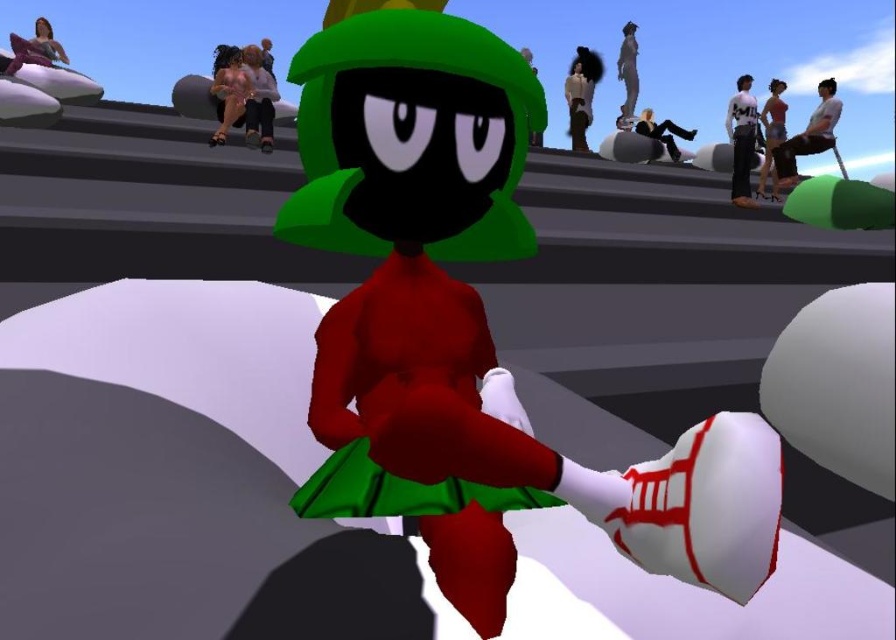
You are a GUI agent. You are given a task and a screenshot of the screen. Output one action in this format:
    pyautogui.click(x=<x>, y=<y>)
    Task: Click on the smooth white shirt at upper right
    
    Given the screenshot: What is the action you would take?
    pyautogui.click(x=808, y=134)

Is smooth white shirt at upper right to the right of matte pink shorts at right from the viewer's perspective?

Incorrect, smooth white shirt at upper right is not on the right side of matte pink shorts at right.

Which is behind, point (777, 173) or point (777, 113)?

The point (777, 113) is more distant.

Identify the location of smooth white shirt at upper right. (808, 134).

Based on the photo, is white cotton shirt at upper right further to camera compared to white matte jacket at upper center?

No, it is in front of white matte jacket at upper center.

Does white cotton shirt at upper right have a lesser width compared to white matte jacket at upper center?

Incorrect, white cotton shirt at upper right's width is not less than white matte jacket at upper center's.

Describe the element at coordinates (742, 140) in the screenshot. Image resolution: width=896 pixels, height=640 pixels. I see `white cotton shirt at upper right` at that location.

Find the location of a particular element. This screenshot has width=896, height=640. white cotton shirt at upper right is located at coordinates (742, 140).

Is white matte jacket at upper center shorter than matte pink shorts at right?

Correct, white matte jacket at upper center is not as tall as matte pink shorts at right.

Does point (582, 120) lie in front of point (760, 193)?

That is False.

Where is `white matte jacket at upper center`? The width and height of the screenshot is (896, 640). white matte jacket at upper center is located at coordinates (582, 93).